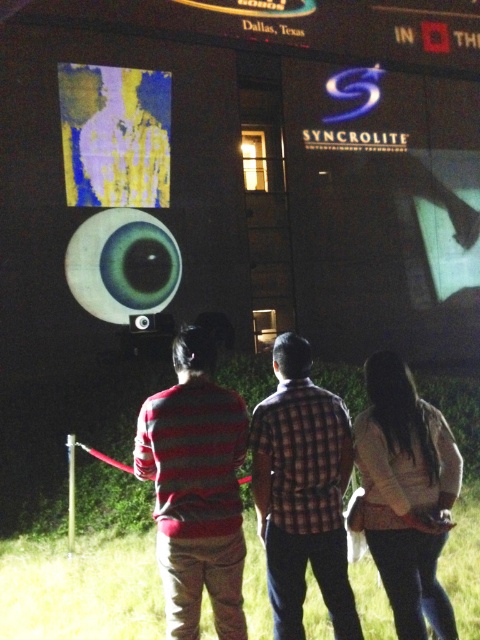
You are standing in front of the building and want to take a photo of the plaid shirt at center and the matte black speaker at center. Which object should you position to the right side of your camera frame?

You should position the plaid shirt at center to the right side of your camera frame because the plaid shirt at center is to the right of the matte black speaker at center according to the description.

You are a photographer trying to capture the projection on the building. You notice the plaid shirt at center and the yellow fabric screen at upper left. Which object should you focus on to ensure the subject is taller in the photo?

The yellow fabric screen at upper left is taller than the plaid shirt at center, so focusing on it will ensure the subject appears taller in the photo.

You are standing in front of the building with the projection. You see a point marked at coordinates [302,492]. What object is located at that point?

The point at coordinates [302,492] corresponds to the plaid shirt at center.